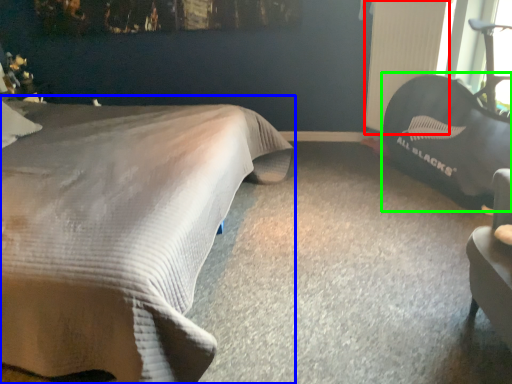
Question: Considering the real-world distances, which object is farthest from radiator (highlighted by a red box)? bed (highlighted by a blue box) or bean bag chair (highlighted by a green box)?

Choices:
 (A) bed
 (B) bean bag chair

Answer: (A)